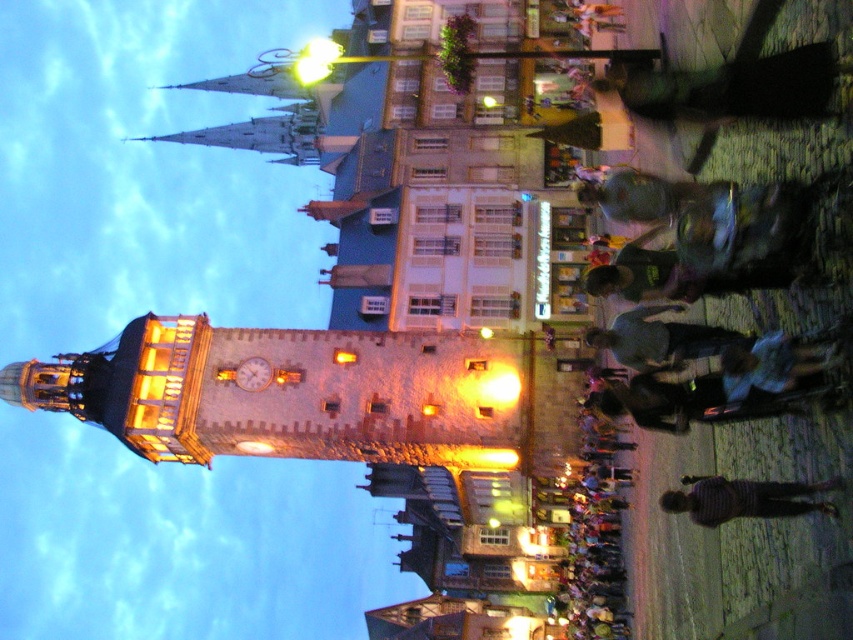
Does dark gray fabric bag at upper right have a larger size compared to striped sweater at lower right?

Indeed, dark gray fabric bag at upper right has a larger size compared to striped sweater at lower right.

Who is shorter, dark gray fabric bag at upper right or striped sweater at lower right?

striped sweater at lower right

You are a GUI agent. You are given a task and a screenshot of the screen. Output one action in this format:
    pyautogui.click(x=<x>, y=<y>)
    Task: Click on the dark gray fabric bag at upper right
    The image size is (853, 640).
    Given the screenshot: What is the action you would take?
    pyautogui.click(x=732, y=88)

Who is higher up, dark gray fabric bag at upper right or gold metallic clock at center?

dark gray fabric bag at upper right

Who is positioned more to the right, dark gray fabric bag at upper right or gold metallic clock at center?

From the viewer's perspective, dark gray fabric bag at upper right appears more on the right side.

Identify the location of dark gray fabric bag at upper right. (732, 88).

Does dark gray shirt at center have a larger size compared to striped sweater at lower right?

No.

What do you see at coordinates (659, 339) in the screenshot? I see `dark gray shirt at center` at bounding box center [659, 339].

Locate an element on the screen. The image size is (853, 640). dark gray shirt at center is located at coordinates (659, 339).